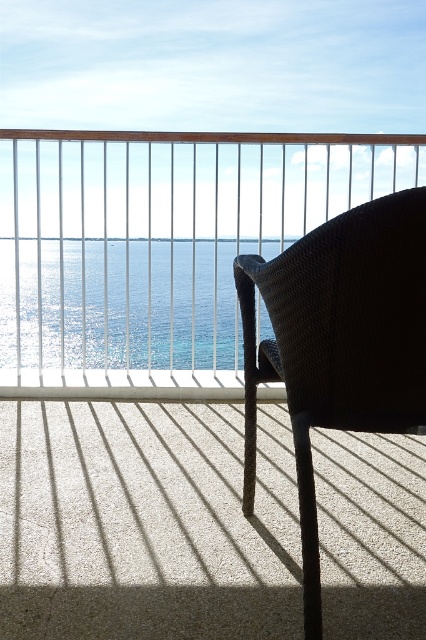
Question: Can you confirm if matte wicker chair at center is positioned to the left of shiny blue water at center?

Choices:
 (A) yes
 (B) no

Answer: (B)

Question: Which point appears farthest from the camera in this image?

Choices:
 (A) (17, 300)
 (B) (5, 269)
 (C) (299, 476)

Answer: (B)

Question: Which is nearer to the woven dark brown armchair at right?

Choices:
 (A) shiny blue water at center
 (B) matte wicker chair at center

Answer: (B)

Question: Does woven dark brown armchair at right lie behind shiny blue water at center?

Choices:
 (A) yes
 (B) no

Answer: (B)

Question: Among these objects, which one is farthest from the camera?

Choices:
 (A) shiny blue water at center
 (B) woven dark brown armchair at right
 (C) matte wicker chair at center

Answer: (C)

Question: Does woven dark brown armchair at right lie behind shiny blue water at center?

Choices:
 (A) no
 (B) yes

Answer: (A)